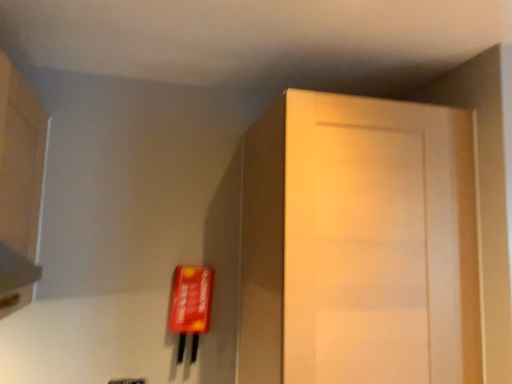
Question: Is matte wood cabinet at upper left bigger or smaller than matte wood door at right?

Choices:
 (A) big
 (B) small

Answer: (B)

Question: Based on their positions, is matte wood cabinet at upper left located to the left or right of matte wood door at right?

Choices:
 (A) right
 (B) left

Answer: (B)

Question: Is point (26, 167) closer or farther from the camera than point (261, 292)?

Choices:
 (A) closer
 (B) farther

Answer: (B)

Question: Considering the positions of matte wood door at right and matte wood cabinet at upper left in the image, is matte wood door at right taller or shorter than matte wood cabinet at upper left?

Choices:
 (A) short
 (B) tall

Answer: (B)

Question: Looking at their shapes, would you say matte wood door at right is wider or thinner than matte wood cabinet at upper left?

Choices:
 (A) thin
 (B) wide

Answer: (B)

Question: Based on their sizes in the image, would you say matte wood door at right is bigger or smaller than matte wood cabinet at upper left?

Choices:
 (A) small
 (B) big

Answer: (B)

Question: Do you think matte wood door at right is within matte wood cabinet at upper left, or outside of it?

Choices:
 (A) inside
 (B) outside

Answer: (B)